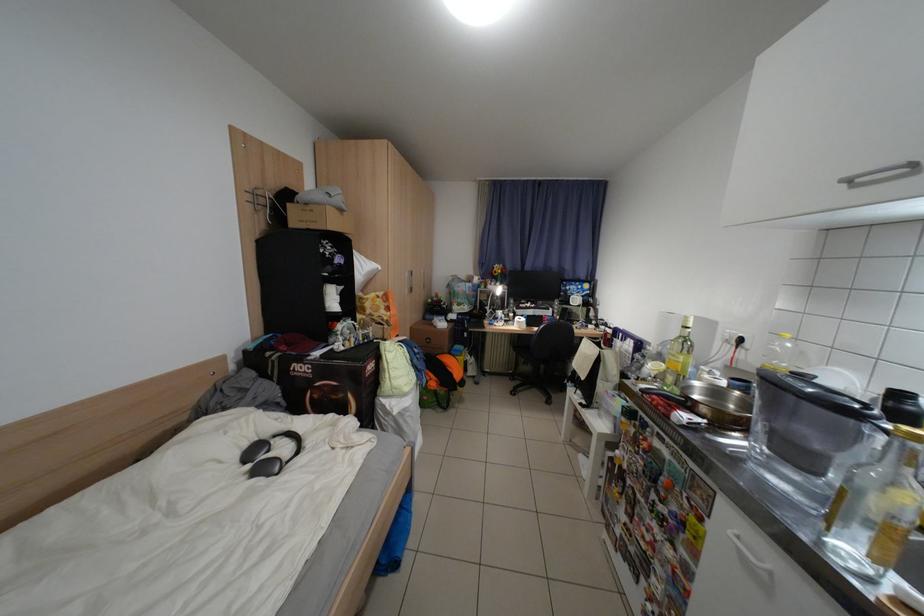
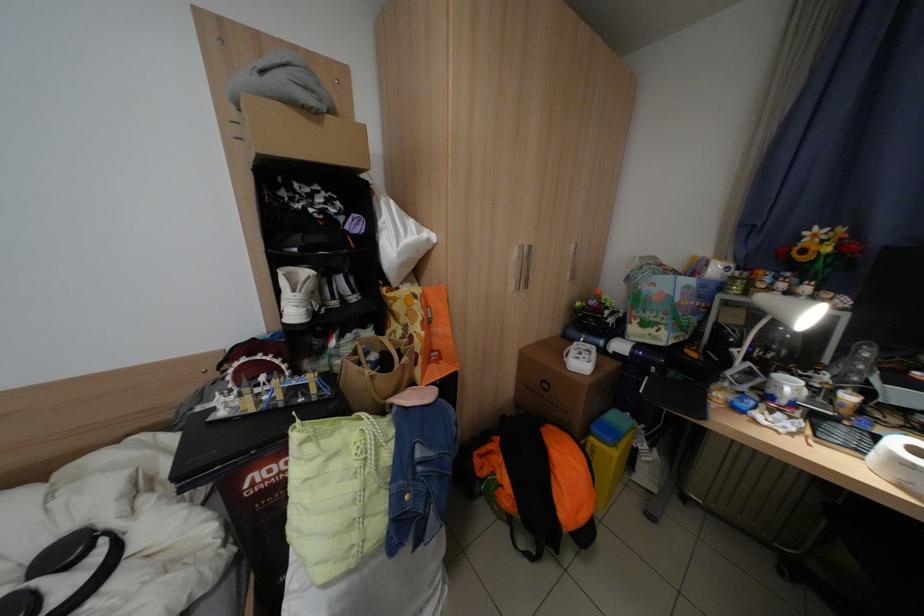
Where in the second image is the point corresponding to (528,318) from the first image?

(906, 442)